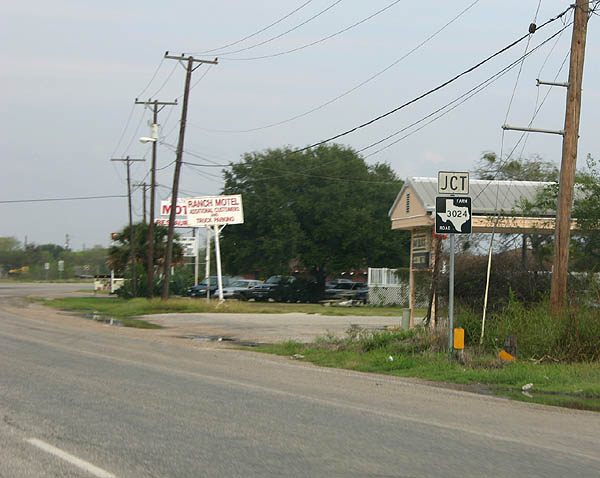
Find the location of a particular element. The width and height of the screenshot is (600, 478). window is located at coordinates (407, 200).